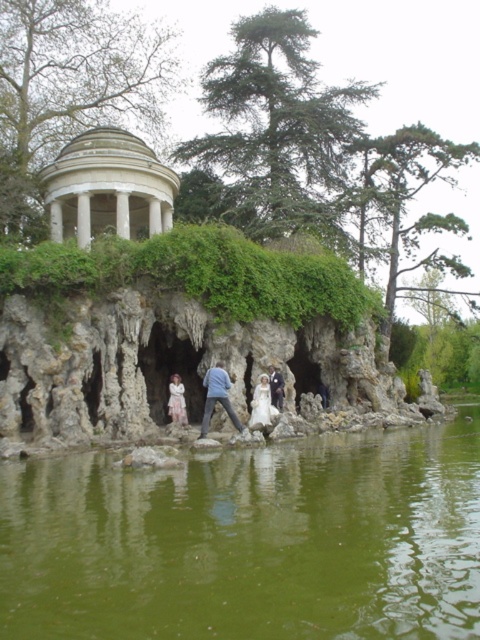
Question: Which point is closer to the camera?

Choices:
 (A) (129, 209)
 (B) (29, 490)
 (C) (268, 392)

Answer: (B)

Question: Estimate the real-world distances between objects in this image. Which object is closer to the green liquid water at center?

Choices:
 (A) blue denim jeans at center
 (B) white marble gazebo at upper center

Answer: (A)

Question: Estimate the real-world distances between objects in this image. Which object is farther from the white marble gazebo at upper center?

Choices:
 (A) white lace dress at center
 (B) blue denim jeans at center
 (C) green liquid water at center
 (D) white satin dress at center

Answer: (C)

Question: Observing the image, what is the correct spatial positioning of green liquid water at center in reference to white lace dress at center?

Choices:
 (A) left
 (B) right

Answer: (B)

Question: Is white marble gazebo at upper center wider than blue denim jeans at center?

Choices:
 (A) yes
 (B) no

Answer: (A)

Question: Is green liquid water at center smaller than white marble gazebo at upper center?

Choices:
 (A) yes
 (B) no

Answer: (A)